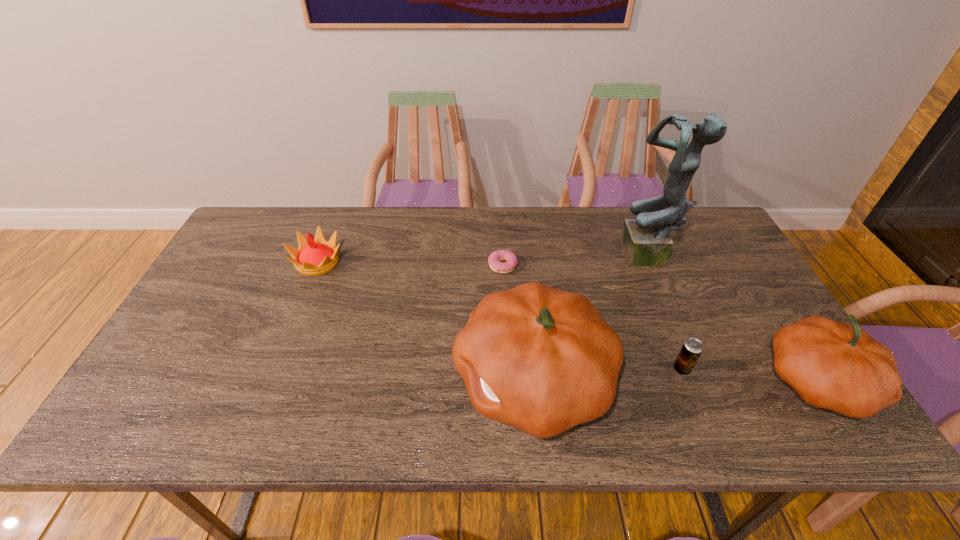
The image size is (960, 540). I want to click on empty space between the rightmost object and the shortest object, so click(660, 324).

Locate an element on the screen. The image size is (960, 540). vacant space in between the sculpture and the crown is located at coordinates (x=484, y=260).

Where is `free space between the beer can and the rightmost object`? This screenshot has width=960, height=540. free space between the beer can and the rightmost object is located at coordinates (750, 375).

Where is `free spot between the beer can and the sculpture`? The image size is (960, 540). free spot between the beer can and the sculpture is located at coordinates (665, 313).

This screenshot has height=540, width=960. Find the location of `vacant space that's between the beer can and the right pumpkin`. vacant space that's between the beer can and the right pumpkin is located at coordinates (750, 375).

Locate an element on the screen. This screenshot has width=960, height=540. vacant space that is in between the doughnut and the sculpture is located at coordinates (576, 261).

The height and width of the screenshot is (540, 960). In order to click on vacant point located between the third tallest object and the fifth tallest object in this screenshot , I will do `click(750, 375)`.

This screenshot has height=540, width=960. Identify the location of free space between the tallest object and the doughnut. 576,261.

Select which object appears as the third closest to the shortest object. Please provide its 2D coordinates. Your answer should be formatted as a tuple, i.e. [(x, y)], where the tuple contains the x and y coordinates of a point satisfying the conditions above.

[(315, 256)]

Identify which object is the nearest to the doughnut. Please provide its 2D coordinates. Your answer should be formatted as a tuple, i.e. [(x, y)], where the tuple contains the x and y coordinates of a point satisfying the conditions above.

[(543, 360)]